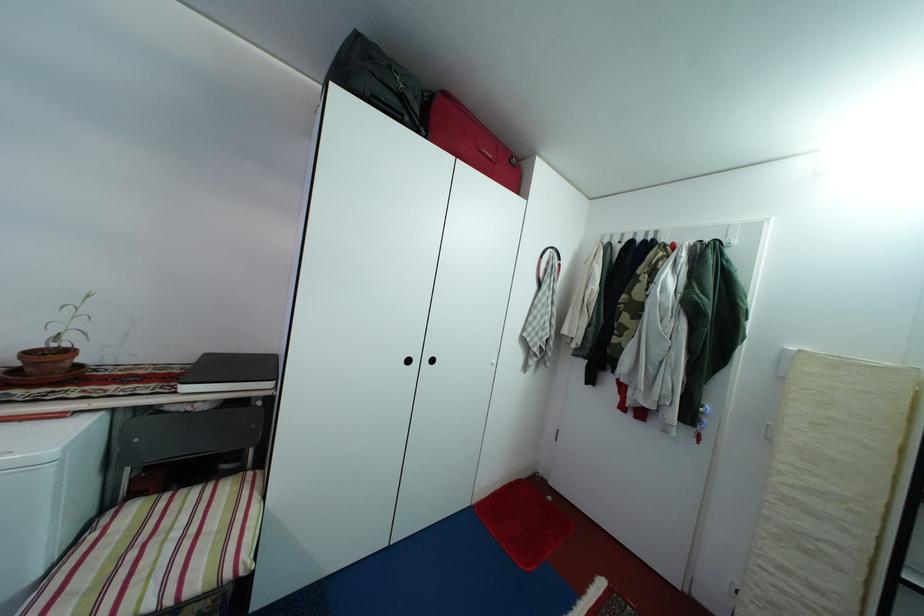
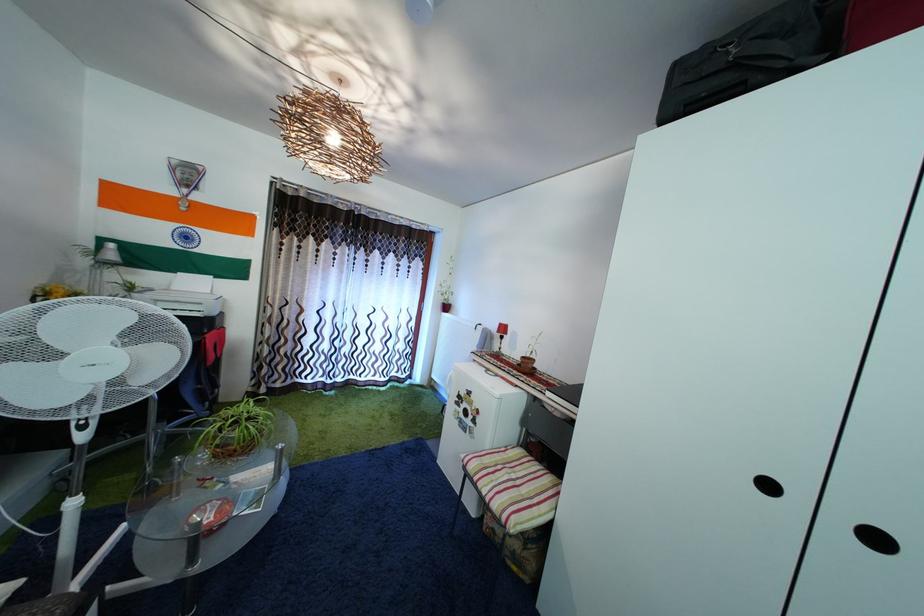
Find the pixel in the second image that matches pixel 185 541 in the first image.

(521, 484)